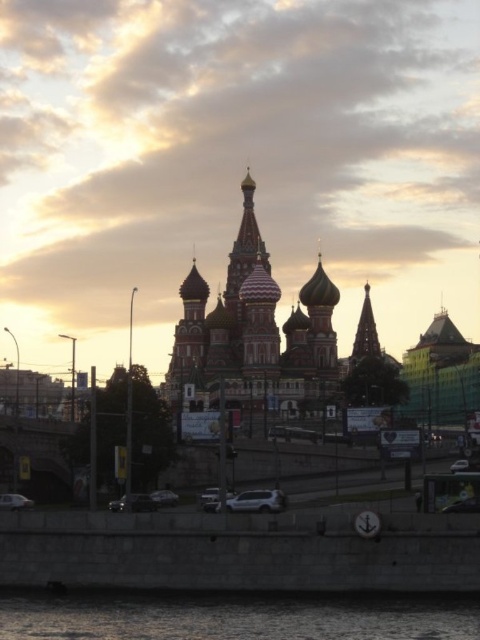
You are a tourist standing on the dark gray concrete river at lower center, looking at the red brick church at center. Which direction should you look to see the church?

The red brick church at center is above the dark gray concrete river at lower center, so you should look upward to see the church.

You are a tourist standing at the dark gray concrete river at lower center, wanting to take a photo of the red brick church at center. Can you walk directly towards the church without crossing any obstacles? The path is 28.93 meters long. Your legs are 0.9 meters long. How many steps would you need to take to reach the church if each step covers 0.7 meters?

The distance between the red brick church at center and the dark gray concrete river at lower center is 28.93 meters. To calculate the number of steps needed, divide the total distance by the step length. 28.93 meters divided by 0.7 meters per step equals approximately 41.33 steps. Since you can only take whole steps, you would need to take 42 steps to cover the distance.

You are standing at the point with coordinates 0.5, 0.5 in the image. Which direction should you move to reach the red brick church at center?

The red brick church at center is located at point (253, 336), so you should move northeast to reach it from your current position at (240, 320).